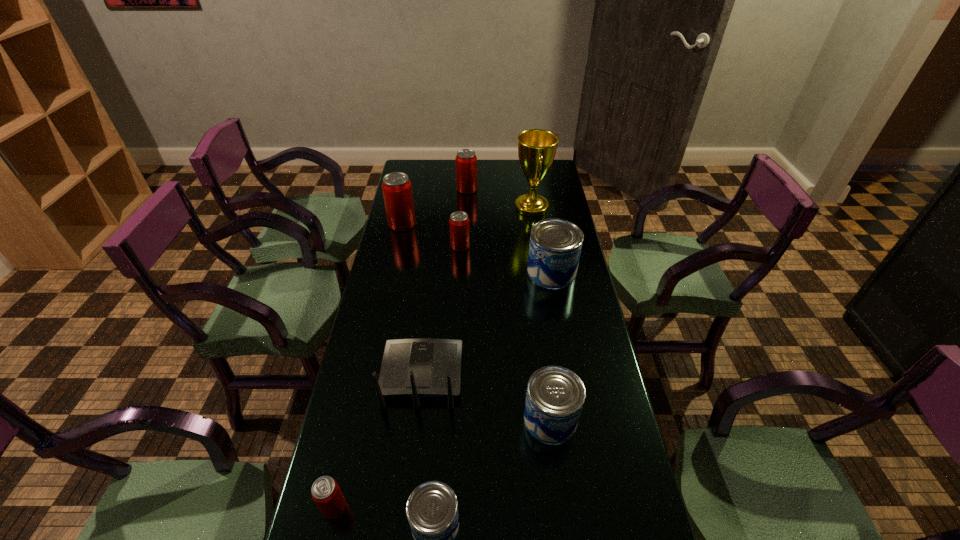
The image size is (960, 540). Find the location of `award`. award is located at coordinates (536, 147).

Locate an element on the screen. This screenshot has width=960, height=540. the tallest object is located at coordinates (536, 147).

At what (x,y) coordinates should I click in order to perform the action: click on the biggest red can. Please return your answer as a coordinate pair (x, y). Looking at the image, I should click on (397, 191).

You are a GUI agent. You are given a task and a screenshot of the screen. Output one action in this format:
    pyautogui.click(x=<x>, y=<y>)
    Task: Click on the tallest can
    The image size is (960, 540).
    Given the screenshot: What is the action you would take?
    pyautogui.click(x=397, y=191)

The image size is (960, 540). What are the coordinates of `the farthest red can` in the screenshot? It's located at (466, 161).

You are a GUI agent. You are given a task and a screenshot of the screen. Output one action in this format:
    pyautogui.click(x=<x>, y=<y>)
    Task: Click on the third smallest red can
    The image size is (960, 540).
    Given the screenshot: What is the action you would take?
    pyautogui.click(x=466, y=161)

Identify the location of the farthest blue can. The width and height of the screenshot is (960, 540). (555, 246).

Where is `the biggest blue can`? The height and width of the screenshot is (540, 960). the biggest blue can is located at coordinates coord(555,246).

This screenshot has width=960, height=540. I want to click on router, so click(x=424, y=367).

The height and width of the screenshot is (540, 960). Identify the location of the third biggest red can. (459, 226).